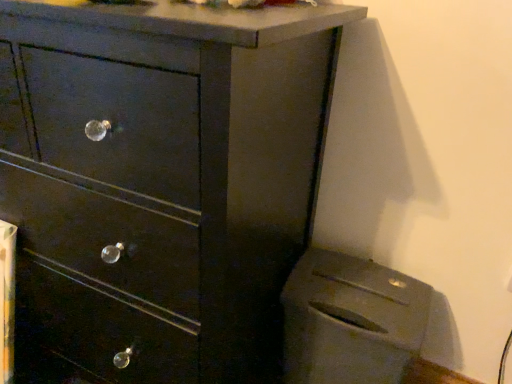
Question: Can you confirm if matte gray trash can at lower right is bigger than matte black dresser at center?

Choices:
 (A) yes
 (B) no

Answer: (B)

Question: Does matte gray trash can at lower right turn towards matte black dresser at center?

Choices:
 (A) no
 (B) yes

Answer: (A)

Question: Would you say matte black dresser at center is part of matte gray trash can at lower right's contents?

Choices:
 (A) no
 (B) yes

Answer: (A)

Question: From the image's perspective, is matte gray trash can at lower right under matte black dresser at center?

Choices:
 (A) no
 (B) yes

Answer: (B)

Question: From a real-world perspective, is matte gray trash can at lower right positioned under matte black dresser at center based on gravity?

Choices:
 (A) yes
 (B) no

Answer: (A)

Question: Is matte gray trash can at lower right turned away from matte black dresser at center?

Choices:
 (A) yes
 (B) no

Answer: (B)

Question: Can you confirm if matte black dresser at center is wider than matte gray trash can at lower right?

Choices:
 (A) yes
 (B) no

Answer: (A)

Question: Considering the relative sizes of matte black dresser at center and matte gray trash can at lower right in the image provided, is matte black dresser at center bigger than matte gray trash can at lower right?

Choices:
 (A) no
 (B) yes

Answer: (B)

Question: Would you say matte black dresser at center contains matte gray trash can at lower right?

Choices:
 (A) yes
 (B) no

Answer: (B)

Question: From the image's perspective, would you say matte black dresser at center is shown under matte gray trash can at lower right?

Choices:
 (A) yes
 (B) no

Answer: (B)

Question: Is matte black dresser at center positioned beyond the bounds of matte gray trash can at lower right?

Choices:
 (A) no
 (B) yes

Answer: (B)

Question: Considering the relative sizes of matte black dresser at center and matte gray trash can at lower right in the image provided, is matte black dresser at center shorter than matte gray trash can at lower right?

Choices:
 (A) no
 (B) yes

Answer: (A)

Question: Does point (164, 158) appear closer or farther from the camera than point (312, 306)?

Choices:
 (A) closer
 (B) farther

Answer: (A)